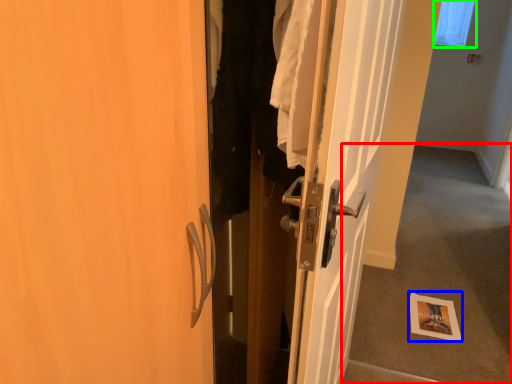
Question: Which object is the closest to the corridor (highlighted by a red box)? Choose among these: postcard (highlighted by a blue box) or window screen (highlighted by a green box).

Choices:
 (A) postcard
 (B) window screen

Answer: (A)